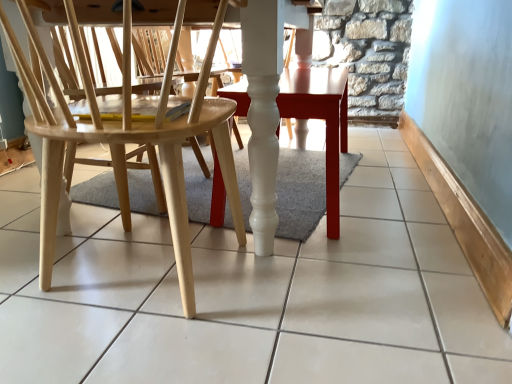
This screenshot has height=384, width=512. What are the coordinates of `vacant area in front of white glossy table at center` in the screenshot? It's located at (359, 264).